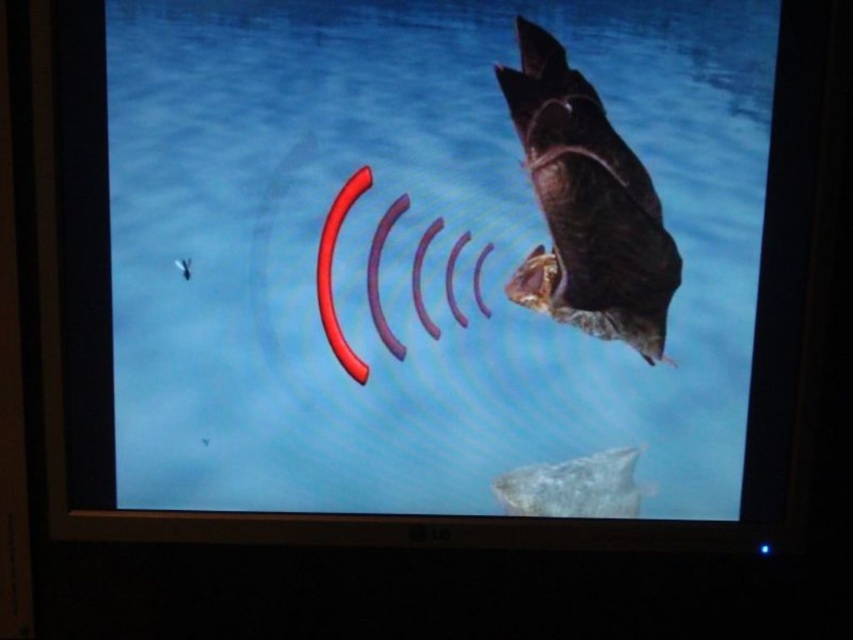
Question: Is shiny metallic fish at right positioned in front of smooth gray fish at bottom center?

Choices:
 (A) no
 (B) yes

Answer: (B)

Question: Which of the following is the farthest from the observer?

Choices:
 (A) (566, 502)
 (B) (631, 204)

Answer: (A)

Question: Can you confirm if shiny metallic fish at right is thinner than smooth gray fish at bottom center?

Choices:
 (A) yes
 (B) no

Answer: (B)

Question: In this image, where is shiny metallic fish at right located relative to smooth gray fish at bottom center?

Choices:
 (A) right
 (B) left

Answer: (B)